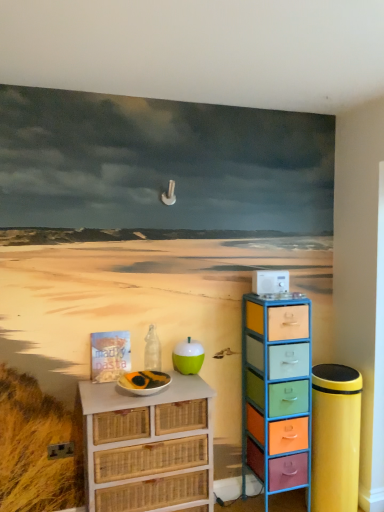
What do you see at coordinates (148, 446) in the screenshot? Image resolution: width=384 pixels, height=512 pixels. I see `white wicker chest of drawers at lower left, which is the first chest of drawers from left to right` at bounding box center [148, 446].

What is the approximate height of teal glossy apple at center?

teal glossy apple at center is 8.58 inches in height.

Identify the location of transparent glass bottle at center. (152, 350).

The image size is (384, 512). What are the coordinates of `white wicker chest of drawers at lower left, the second chest of drawers from the right` in the screenshot? It's located at pos(148,446).

Which of these two, white wicker chest of drawers at lower left, which is the first chest of drawers from left to right, or multicolored plastic drawers at right, which is counted as the second chest of drawers, starting from the left, is wider?

Wider between the two is white wicker chest of drawers at lower left, which is the first chest of drawers from left to right.

Which is more to the left, white wicker chest of drawers at lower left, the second chest of drawers from the right, or multicolored plastic drawers at right, the first chest of drawers when ordered from right to left?

white wicker chest of drawers at lower left, the second chest of drawers from the right.

Is white wicker chest of drawers at lower left, the second chest of drawers from the right, directly adjacent to multicolored plastic drawers at right, the first chest of drawers when ordered from right to left?

They are not placed beside each other.

Considering the sizes of teal glossy apple at center and white wicker chest of drawers at lower left, the second chest of drawers from the right, in the image, is teal glossy apple at center wider or thinner than white wicker chest of drawers at lower left, the second chest of drawers from the right,?

teal glossy apple at center is thinner than white wicker chest of drawers at lower left, the second chest of drawers from the right.

Looking at this image, which of these two, teal glossy apple at center or white wicker chest of drawers at lower left, the second chest of drawers from the right, stands shorter?

Standing shorter between the two is teal glossy apple at center.

Would you say teal glossy apple at center contains white wicker chest of drawers at lower left, the second chest of drawers from the right?

No, white wicker chest of drawers at lower left, the second chest of drawers from the right, is not inside teal glossy apple at center.

Between teal glossy apple at center and white wicker chest of drawers at lower left, the second chest of drawers from the right, which one is positioned in front?

white wicker chest of drawers at lower left, the second chest of drawers from the right.

In terms of size, does multicolored plastic drawers at right, which is counted as the second chest of drawers, starting from the left, appear bigger or smaller than teal glossy apple at center?

Clearly, multicolored plastic drawers at right, which is counted as the second chest of drawers, starting from the left, is larger in size than teal glossy apple at center.

What's the angular difference between multicolored plastic drawers at right, the first chest of drawers when ordered from right to left, and teal glossy apple at center's facing directions?

They differ by 0.0757 degrees in their facing directions.

Find the location of a particular element. The width and height of the screenshot is (384, 512). teal above the multicolored plastic drawers at right, which is counted as the second chest of drawers, starting from the left (from a real-world perspective) is located at coordinates (188, 356).

From the image's perspective, which one is positioned lower, multicolored plastic drawers at right, the first chest of drawers when ordered from right to left, or teal glossy apple at center?

multicolored plastic drawers at right, the first chest of drawers when ordered from right to left.

Considering the relative positions of transparent glass bottle at center and multicolored plastic drawers at right, which is counted as the second chest of drawers, starting from the left, in the image provided, is transparent glass bottle at center to the right of multicolored plastic drawers at right, which is counted as the second chest of drawers, starting from the left, from the viewer's perspective?

In fact, transparent glass bottle at center is to the left of multicolored plastic drawers at right, which is counted as the second chest of drawers, starting from the left.

Between transparent glass bottle at center and multicolored plastic drawers at right, the first chest of drawers when ordered from right to left, which one is positioned in front?

multicolored plastic drawers at right, the first chest of drawers when ordered from right to left, is more forward.

You are a GUI agent. You are given a task and a screenshot of the screen. Output one action in this format:
    pyautogui.click(x=<x>, y=<y>)
    Task: Click on the bottle located on the left of multicolored plastic drawers at right, the first chest of drawers when ordered from right to left
    
    Given the screenshot: What is the action you would take?
    tap(152, 350)

Is point (152, 330) positioned before point (276, 334)?

That is False.

Considering the sizes of multicolored plastic drawers at right, the first chest of drawers when ordered from right to left, and transparent glass bottle at center in the image, is multicolored plastic drawers at right, the first chest of drawers when ordered from right to left, bigger or smaller than transparent glass bottle at center?

Clearly, multicolored plastic drawers at right, the first chest of drawers when ordered from right to left, is larger in size than transparent glass bottle at center.

In the scene shown: Does multicolored plastic drawers at right, which is counted as the second chest of drawers, starting from the left, have a lesser width compared to transparent glass bottle at center?

Incorrect, the width of multicolored plastic drawers at right, which is counted as the second chest of drawers, starting from the left, is not less than that of transparent glass bottle at center.

From the image's perspective, which is below, multicolored plastic drawers at right, which is counted as the second chest of drawers, starting from the left, or transparent glass bottle at center?

multicolored plastic drawers at right, which is counted as the second chest of drawers, starting from the left, is shown below in the image.

From a real-world perspective, which object rests below the other?

From a 3D spatial view, multicolored plastic drawers at right, the first chest of drawers when ordered from right to left, is below.

Are white wicker chest of drawers at lower left, which is the first chest of drawers from left to right, and teal glossy apple at center beside each other?

No, white wicker chest of drawers at lower left, which is the first chest of drawers from left to right, is not beside teal glossy apple at center.

In the image, is white wicker chest of drawers at lower left, which is the first chest of drawers from left to right, on the left side or the right side of teal glossy apple at center?

From the image, it's evident that white wicker chest of drawers at lower left, which is the first chest of drawers from left to right, is to the left of teal glossy apple at center.

Can you confirm if white wicker chest of drawers at lower left, the second chest of drawers from the right, is smaller than teal glossy apple at center?

Incorrect, white wicker chest of drawers at lower left, the second chest of drawers from the right, is not smaller in size than teal glossy apple at center.

The image size is (384, 512). I want to click on teal located on the right of white wicker chest of drawers at lower left, the second chest of drawers from the right, so click(188, 356).

Is point (202, 357) closer to viewer compared to point (279, 405)?

That is False.

This screenshot has height=512, width=384. In order to click on teal above the multicolored plastic drawers at right, which is counted as the second chest of drawers, starting from the left (from the image's perspective) in this screenshot , I will do pos(188,356).

From a real-world perspective, is teal glossy apple at center below multicolored plastic drawers at right, the first chest of drawers when ordered from right to left?

No, from a real-world perspective, teal glossy apple at center is not beneath multicolored plastic drawers at right, the first chest of drawers when ordered from right to left.

Locate an element on the screen. This screenshot has height=512, width=384. chest of drawers below the multicolored plastic drawers at right, the first chest of drawers when ordered from right to left (from a real-world perspective) is located at coordinates (148, 446).

I want to click on teal located on the right of white wicker chest of drawers at lower left, the second chest of drawers from the right, so click(188, 356).

Estimate the real-world distances between objects in this image. Which object is closer to transparent glass bottle at center, white wicker chest of drawers at lower left, the second chest of drawers from the right, or teal glossy apple at center?

teal glossy apple at center lies closer to transparent glass bottle at center than the other object.

Considering their positions, is white wicker chest of drawers at lower left, the second chest of drawers from the right, positioned further to multicolored plastic drawers at right, the first chest of drawers when ordered from right to left, than transparent glass bottle at center?

transparent glass bottle at center.

From the image, which object appears to be nearer to multicolored plastic drawers at right, which is counted as the second chest of drawers, starting from the left, teal glossy apple at center or transparent glass bottle at center?

The object closer to multicolored plastic drawers at right, which is counted as the second chest of drawers, starting from the left, is teal glossy apple at center.

Which object lies further to the anchor point teal glossy apple at center, white wicker chest of drawers at lower left, the second chest of drawers from the right, or multicolored plastic drawers at right, the first chest of drawers when ordered from right to left?

multicolored plastic drawers at right, the first chest of drawers when ordered from right to left, is further to teal glossy apple at center.

Based on their spatial positions, is transparent glass bottle at center or teal glossy apple at center closer to multicolored plastic drawers at right, the first chest of drawers when ordered from right to left?

The object closer to multicolored plastic drawers at right, the first chest of drawers when ordered from right to left, is teal glossy apple at center.

Estimate the real-world distances between objects in this image. Which object is further from white wicker chest of drawers at lower left, which is the first chest of drawers from left to right, multicolored plastic drawers at right, which is counted as the second chest of drawers, starting from the left, or teal glossy apple at center?

Among the two, multicolored plastic drawers at right, which is counted as the second chest of drawers, starting from the left, is located further to white wicker chest of drawers at lower left, which is the first chest of drawers from left to right.

Estimate the real-world distances between objects in this image. Which object is closer to transparent glass bottle at center, teal glossy apple at center or multicolored plastic drawers at right, which is counted as the second chest of drawers, starting from the left?

Based on the image, teal glossy apple at center appears to be nearer to transparent glass bottle at center.

Based on their spatial positions, is transparent glass bottle at center or white wicker chest of drawers at lower left, the second chest of drawers from the right, further from teal glossy apple at center?

white wicker chest of drawers at lower left, the second chest of drawers from the right.

Locate an element on the screen. This screenshot has height=512, width=384. teal between white wicker chest of drawers at lower left, the second chest of drawers from the right, and multicolored plastic drawers at right, which is counted as the second chest of drawers, starting from the left is located at coordinates (188, 356).

Identify the location of teal between transparent glass bottle at center and white wicker chest of drawers at lower left, which is the first chest of drawers from left to right, vertically. This screenshot has width=384, height=512. (188, 356).

You are a GUI agent. You are given a task and a screenshot of the screen. Output one action in this format:
    pyautogui.click(x=<x>, y=<y>)
    Task: Click on the teal between transparent glass bottle at center and multicolored plastic drawers at right, which is counted as the second chest of drawers, starting from the left, in the horizontal direction
    
    Given the screenshot: What is the action you would take?
    pyautogui.click(x=188, y=356)

In order to click on bottle between white wicker chest of drawers at lower left, the second chest of drawers from the right, and multicolored plastic drawers at right, the first chest of drawers when ordered from right to left, from left to right in this screenshot , I will do `click(152, 350)`.